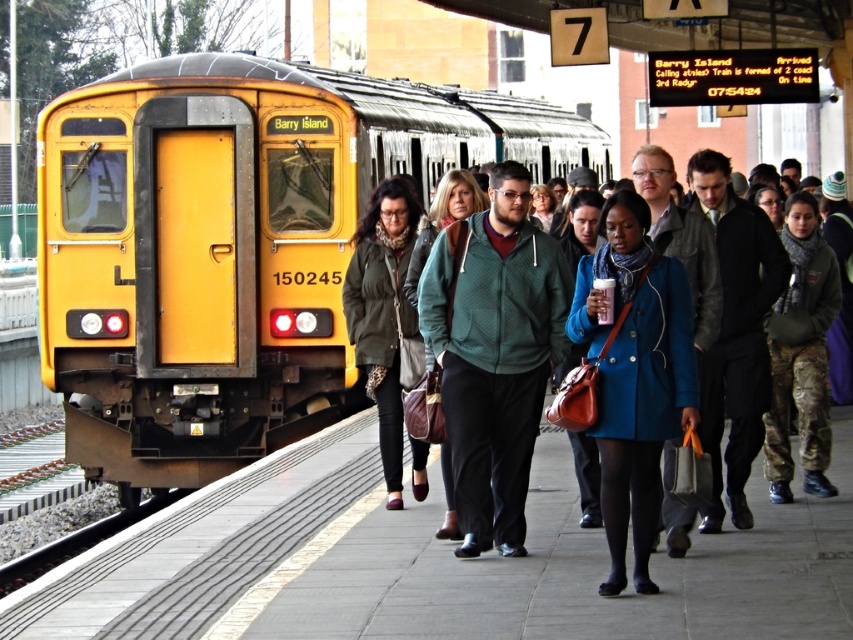
You are a commuter waiting at platform 7 of the train station. You notice two people ahead of you wearing a green textured hoodie at center and a matte blue coat at center. Which clothing item is positioned to the left?

The green textured hoodie at center is positioned to the left of the matte blue coat at center.

You are a passenger waiting at the train station platform. You see the yellow matte train at left and the camouflage pants at center. Which object is closer to you?

The yellow matte train at left is closer to you because it is positioned over the camouflage pants at center, indicating it is in front of it.

You are a passenger waiting at the train station. You see the yellow matte train at left and the camouflage pants at center. Which object is closer to you?

The yellow matte train at left is closer to you because the camouflage pants at center is behind it.